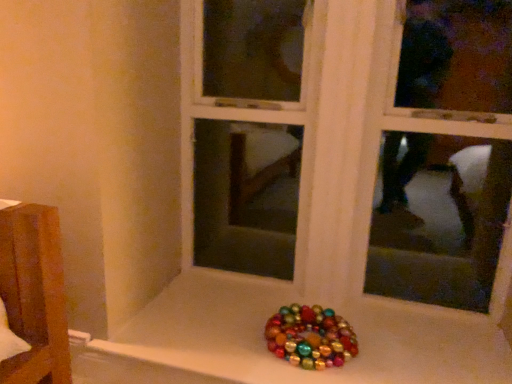
Identify the location of vacant region to the right of multicolored glossy beads at bottom center. (387, 347).